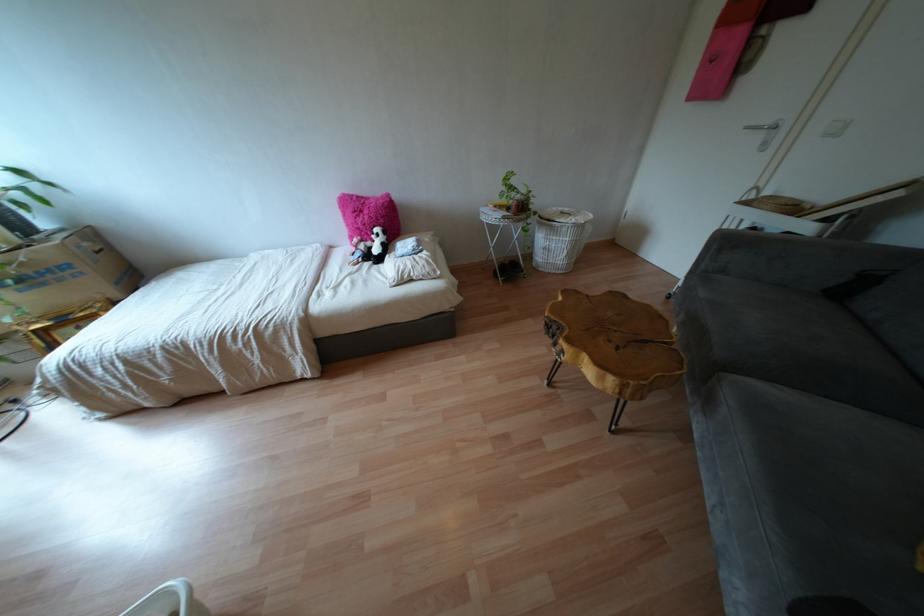
Find the location of a particular element. The image size is (924, 616). pink fluffy pillow is located at coordinates (369, 215).